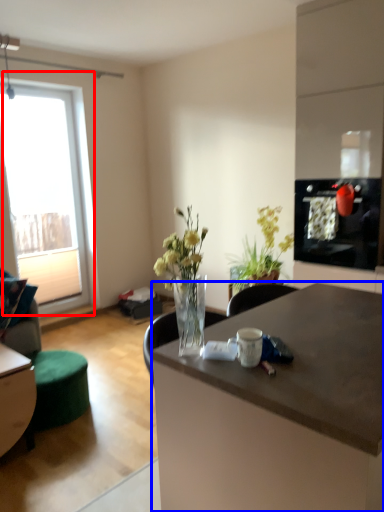
Question: Among these objects, which one is farthest to the camera, window (highlighted by a red box) or desk (highlighted by a blue box)?

Choices:
 (A) window
 (B) desk

Answer: (A)